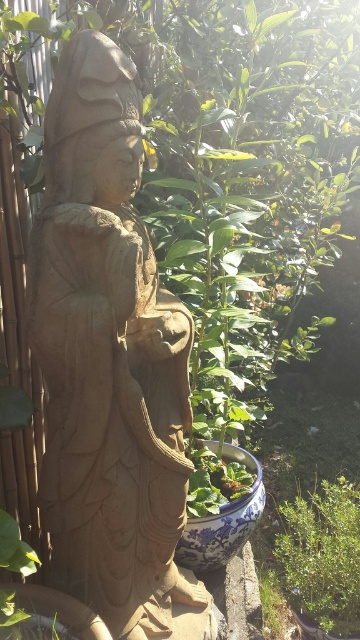
Does smooth beige statue at center have a greater width compared to green leafy plant at lower right?

Yes, smooth beige statue at center is wider than green leafy plant at lower right.

Is smooth beige statue at center shorter than green leafy plant at lower right?

No, smooth beige statue at center is not shorter than green leafy plant at lower right.

At what (x,y) coordinates should I click in order to perform the action: click on smooth beige statue at center. Please return your answer as a coordinate pair (x, y). The image size is (360, 640). Looking at the image, I should click on [x=110, y=362].